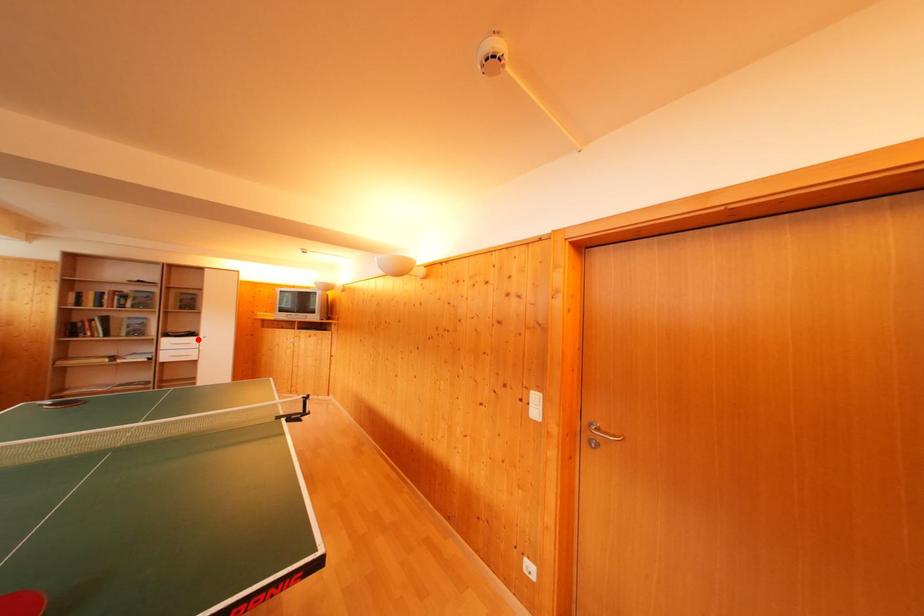
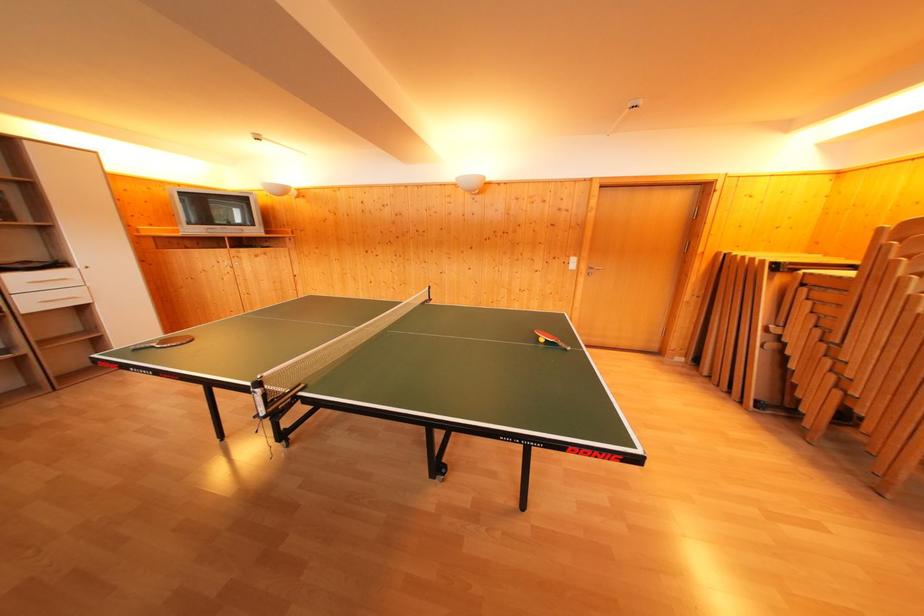
The point at the highlighted location is marked in the first image. Where is the corresponding point in the second image?

(64, 270)